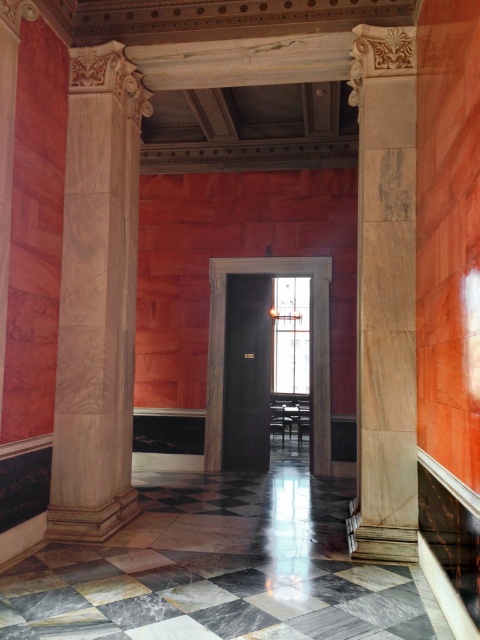
Who is shorter, marble column at center or dark wood door at center?

dark wood door at center is shorter.

What do you see at coordinates (96, 298) in the screenshot? The width and height of the screenshot is (480, 640). I see `marble column at center` at bounding box center [96, 298].

The image size is (480, 640). What are the coordinates of `marble column at center` in the screenshot? It's located at (96, 298).

Who is more distant from viewer, (59, 310) or (379, 262)?

Point (59, 310)

Is marble column at center above white marble column at right?

Yes, marble column at center is above white marble column at right.

The height and width of the screenshot is (640, 480). I want to click on marble column at center, so click(96, 298).

How much distance is there between white marble column at right and dark wood door at center?

A distance of 2.94 meters exists between white marble column at right and dark wood door at center.

Between point (414, 140) and point (317, 292), which one is positioned in front?

Positioned in front is point (414, 140).

You are a GUI agent. You are given a task and a screenshot of the screen. Output one action in this format:
    pyautogui.click(x=<x>, y=<y>)
    Task: Click on the white marble column at right
    
    Given the screenshot: What is the action you would take?
    pyautogui.click(x=385, y=292)